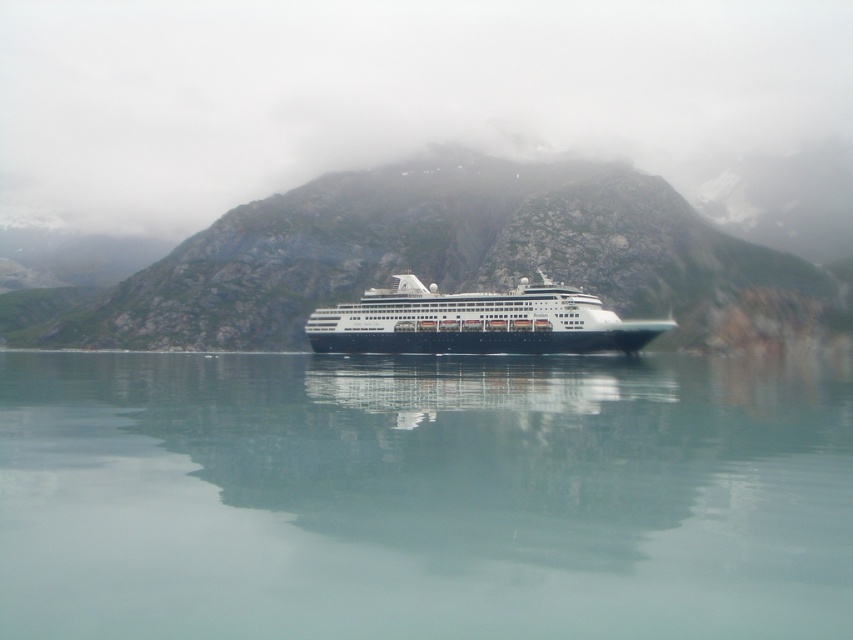
Question: Can you confirm if clear water at center is positioned to the right of rocky mountain at center?

Choices:
 (A) yes
 (B) no

Answer: (A)

Question: Which point is farther to the camera?

Choices:
 (A) (808, 608)
 (B) (415, 285)
 (C) (485, 232)

Answer: (C)

Question: Which point appears closest to the camera in this image?

Choices:
 (A) (409, 339)
 (B) (737, 252)
 (C) (660, 584)

Answer: (C)

Question: Does rocky mountain at center appear over shiny black cruise ship at center?

Choices:
 (A) yes
 (B) no

Answer: (A)

Question: Which object is farther from the camera taking this photo?

Choices:
 (A) rocky mountain at center
 (B) clear water at center
 (C) shiny black cruise ship at center

Answer: (A)

Question: Can you confirm if clear water at center is wider than rocky mountain at center?

Choices:
 (A) no
 (B) yes

Answer: (A)